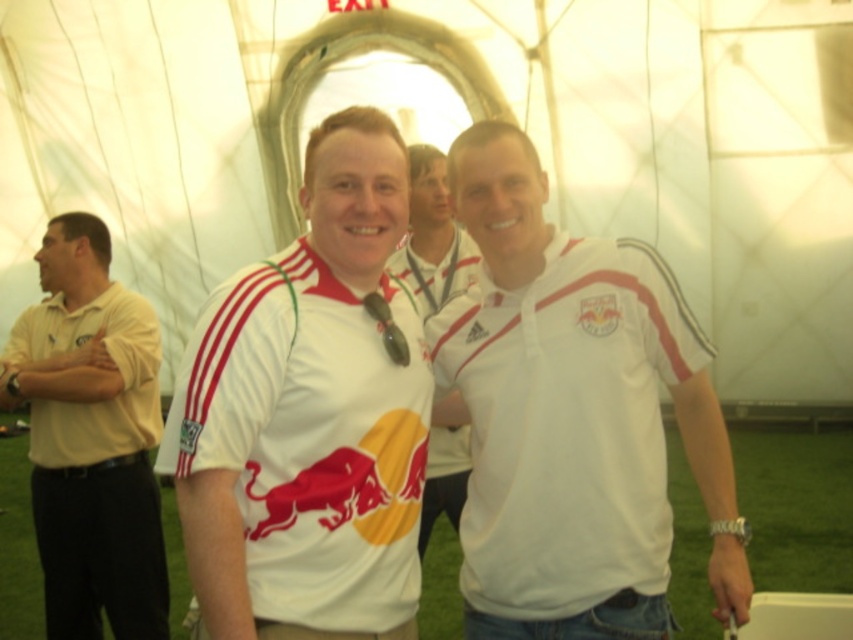
Between white matte shirt at center and white matte jersey at center, which one appears on the right side from the viewer's perspective?

Positioned to the right is white matte shirt at center.

Can you confirm if white matte shirt at center is bigger than white matte jersey at center?

Correct, white matte shirt at center is larger in size than white matte jersey at center.

Is point (746, 570) closer to viewer compared to point (456, 506)?

Yes.

Where is `white matte shirt at center`? The image size is (853, 640). white matte shirt at center is located at coordinates (572, 417).

Does white matte shirt at center appear on the left side of white fabric shirt at center?

No, white matte shirt at center is not to the left of white fabric shirt at center.

Is white matte shirt at center bigger than white fabric shirt at center?

Yes.

What do you see at coordinates (572, 417) in the screenshot? I see `white matte shirt at center` at bounding box center [572, 417].

Locate an element on the screen. The width and height of the screenshot is (853, 640). white matte shirt at center is located at coordinates (572, 417).

Does white fabric shirt at center have a greater height compared to white matte jersey at center?

Yes.

Is white fabric shirt at center smaller than white matte jersey at center?

No, white fabric shirt at center is not smaller than white matte jersey at center.

Is point (352, 627) in front of point (424, 144)?

Yes, it is in front of point (424, 144).

In order to click on white fabric shirt at center in this screenshot , I will do `click(309, 413)`.